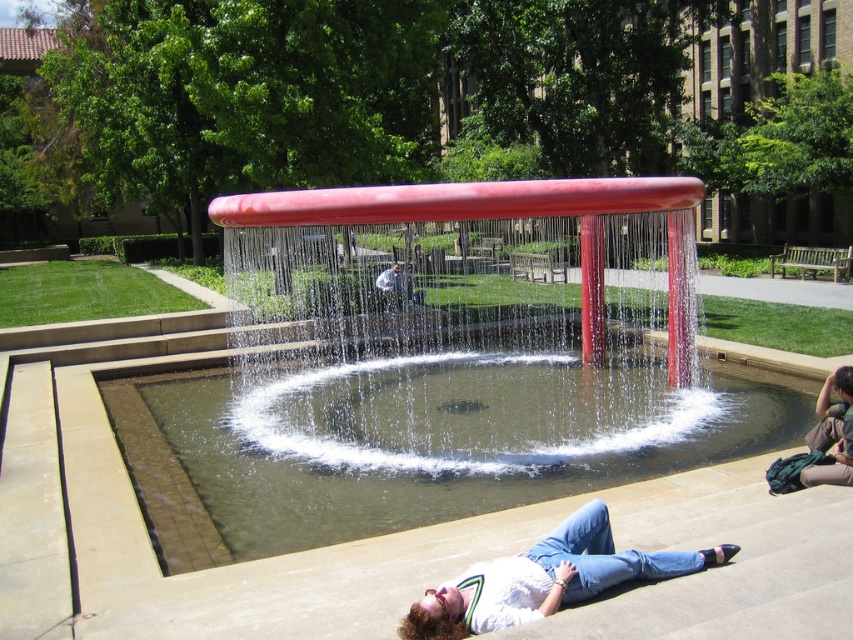
Question: Is smooth red water feature at center bigger than smooth white shirt at center?

Choices:
 (A) yes
 (B) no

Answer: (A)

Question: Which point is farther to the camera?

Choices:
 (A) (633, 436)
 (B) (817, 428)
 (C) (497, 616)

Answer: (A)

Question: Considering the real-world distances, which object is closest to the white matte shirt at lower center?

Choices:
 (A) smooth white shirt at center
 (B) denim jeans at lower right

Answer: (B)

Question: Where is denim jeans at lower right located in relation to smooth white shirt at center in the image?

Choices:
 (A) above
 (B) below

Answer: (B)

Question: Where is white matte shirt at lower center located in relation to smooth white shirt at center in the image?

Choices:
 (A) above
 (B) below

Answer: (B)

Question: Which object is positioned farthest from the denim jeans at lower right?

Choices:
 (A) white matte shirt at lower center
 (B) smooth red water feature at center
 (C) smooth white shirt at center

Answer: (C)